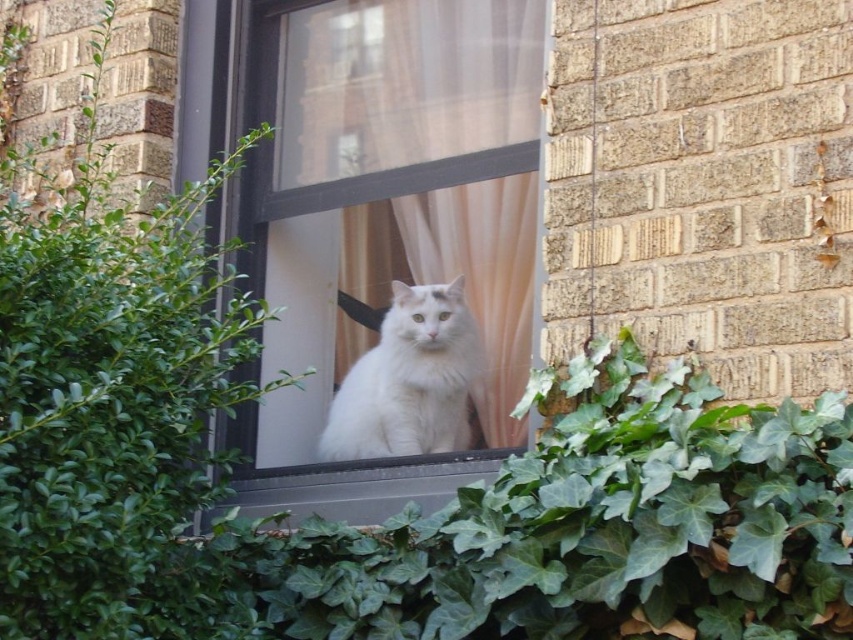
You are a photographer trying to capture the white fluffy cat at center through the clear glass window at center. Can you position yourself to the right of the window to avoid reflections? Explain why or why not based on their positions.

The clear glass window at center is to the left of the white fluffy cat at center, so positioning yourself to the right of the window would place you directly opposite the cat. This might reduce reflections if the light source is coming from the other side, but since the window is between you and the cat, reflections could still be an issue depending on the lighting conditions.

In the scene shown: You are a window cleaner standing at the base of the brick building. You need to clean the clear glass window at center and the green leafy bush at center. Which one will you clean first?

The clear glass window at center is much taller than the green leafy bush at center, so you will need to clean the green leafy bush at center first since it is lower and accessible from the ground.

From the picture: You are standing in front of the window where the white cat is sitting. You notice two points marked on the window frame. One is at coordinates point [90,97] and the other at point [372,388]. Which point is closer to you?

Point [372,388] is closer to you because it is in front of point [90,97] according to their positions.